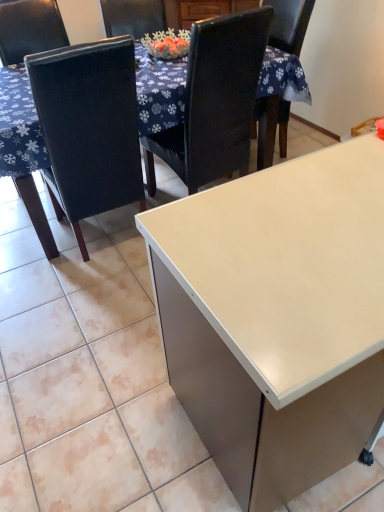
Locate an element on the screen. Image resolution: width=384 pixels, height=512 pixels. free spot in front of matte black chair at left, the 2th chair from the right is located at coordinates (82, 307).